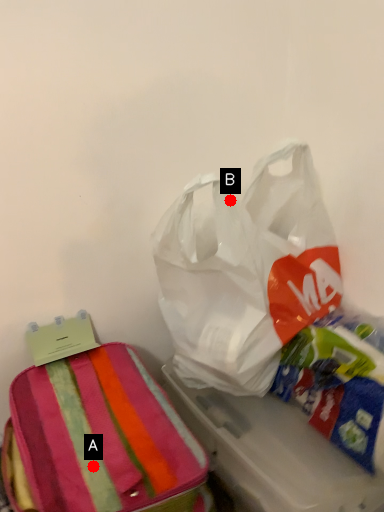
Question: Two points are circled on the image, labeled by A and B beside each circle. Which point appears farthest from the camera in this image?

Choices:
 (A) A is further
 (B) B is further

Answer: (B)